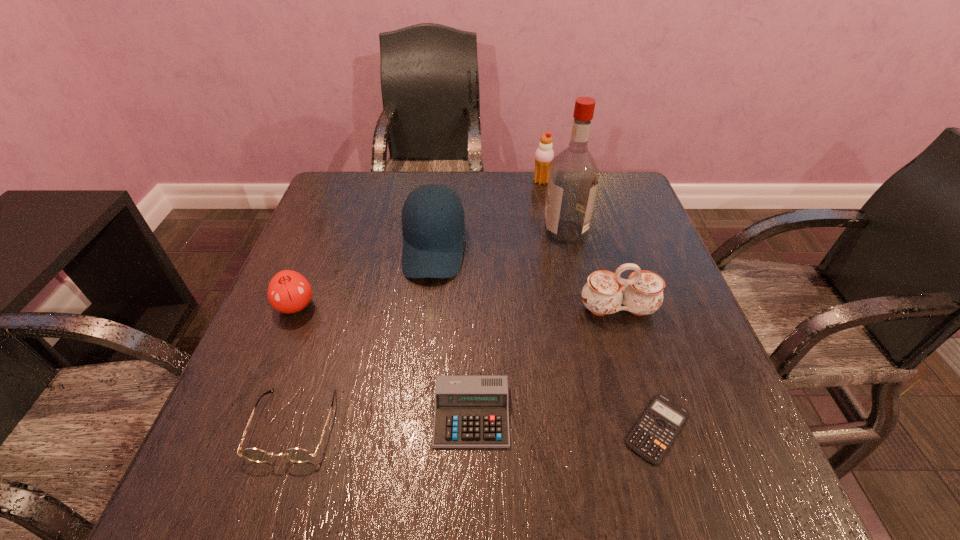
Find the location of `object that is at the near right corner`. object that is at the near right corner is located at coordinates (652, 436).

In the image, there is a desktop. At what (x,y) coordinates should I click in order to perform the action: click on vacant space at the far edge. Please return your answer as a coordinate pair (x, y). Looking at the image, I should click on (510, 179).

Where is `vacant space at the near edge of the desktop`? Image resolution: width=960 pixels, height=540 pixels. vacant space at the near edge of the desktop is located at coordinates (350, 478).

Where is `vacant space at the left edge`? This screenshot has height=540, width=960. vacant space at the left edge is located at coordinates click(x=319, y=315).

Where is `vacant space at the right edge of the desktop`? vacant space at the right edge of the desktop is located at coordinates (635, 247).

The width and height of the screenshot is (960, 540). I want to click on vacant area at the far left corner, so click(x=364, y=208).

Image resolution: width=960 pixels, height=540 pixels. I want to click on vacant space at the far right corner of the desktop, so click(599, 200).

In order to click on vacant area that lies between the farthest object and the left calculator in this screenshot , I will do `click(507, 298)`.

Identify the location of free space that is in between the chinaware and the baseball cap. (526, 279).

In order to click on free space between the baseball cap and the farthest object in this screenshot , I will do `click(488, 215)`.